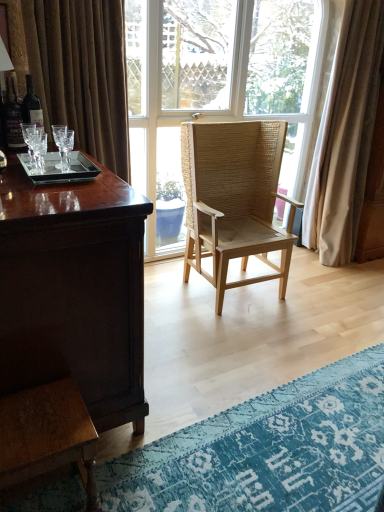
This screenshot has height=512, width=384. I want to click on vacant space in front of natural woven wood chair at center, so click(x=237, y=338).